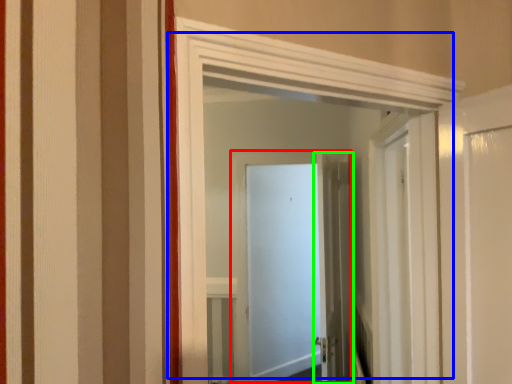
Question: Considering the real-world distances, which object is farthest from door (highlighted by a red box)? door (highlighted by a blue box) or door (highlighted by a green box)?

Choices:
 (A) door
 (B) door

Answer: (A)